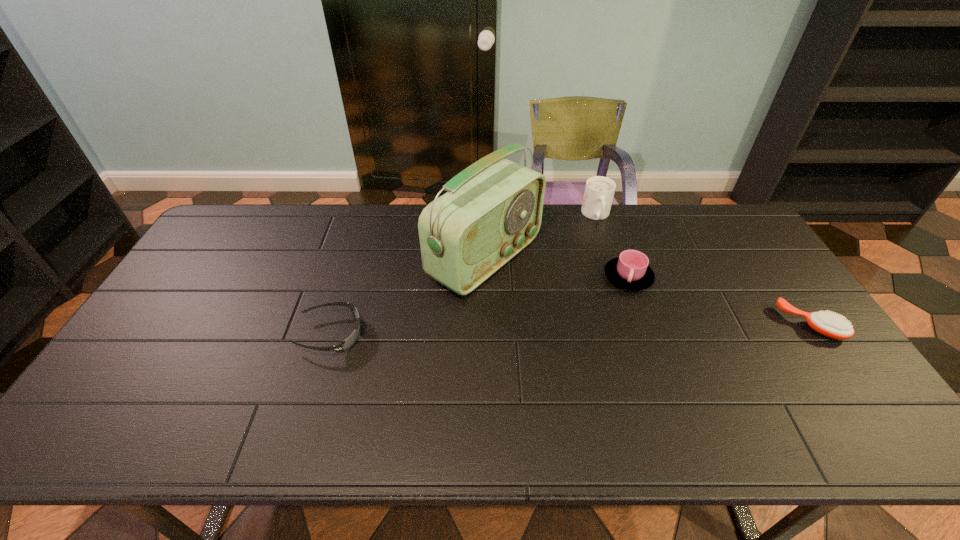
Locate an element on the screen. Image resolution: width=960 pixels, height=540 pixels. free space on the desktop that is between the leftmost object and the hairbrush and is positioned on the front panel of the tallest object is located at coordinates (610, 328).

Where is `vacant space on the desktop that is between the sunglasses and the hairbrush and is positioned on the side with the handle of the cup`? Image resolution: width=960 pixels, height=540 pixels. vacant space on the desktop that is between the sunglasses and the hairbrush and is positioned on the side with the handle of the cup is located at coordinates (641, 328).

Image resolution: width=960 pixels, height=540 pixels. Find the location of `free spot on the desktop that is between the leftmost object and the hairbrush and is positioned on the side with the handle of the cappuccino`. free spot on the desktop that is between the leftmost object and the hairbrush and is positioned on the side with the handle of the cappuccino is located at coordinates (623, 328).